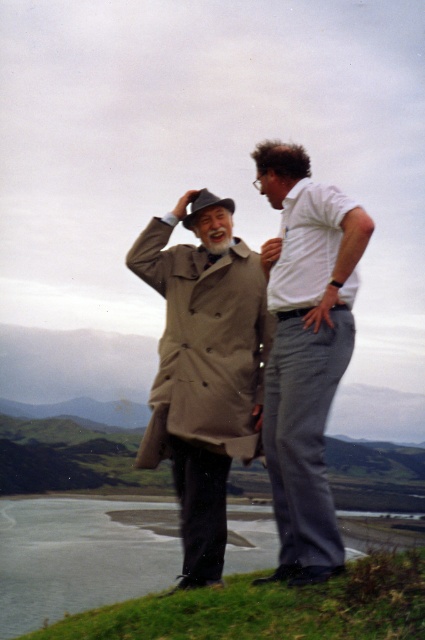
Question: Can you confirm if white cotton shirt at center is positioned above beige fabric trench coat at center?

Choices:
 (A) yes
 (B) no

Answer: (B)

Question: Does white cotton shirt at center come behind beige fabric trench coat at center?

Choices:
 (A) yes
 (B) no

Answer: (B)

Question: Can you confirm if beige wool coat at center is positioned to the right of white cotton shirt at center?

Choices:
 (A) yes
 (B) no

Answer: (B)

Question: Which object appears closest to the camera in this image?

Choices:
 (A) beige fabric trench coat at center
 (B) beige wool coat at center

Answer: (B)

Question: Which point is farther to the camera?

Choices:
 (A) white cotton shirt at center
 (B) beige fabric trench coat at center

Answer: (B)

Question: Which point appears farthest from the camera in this image?

Choices:
 (A) pos(244,445)
 (B) pos(274,404)
 (C) pos(305,172)

Answer: (C)